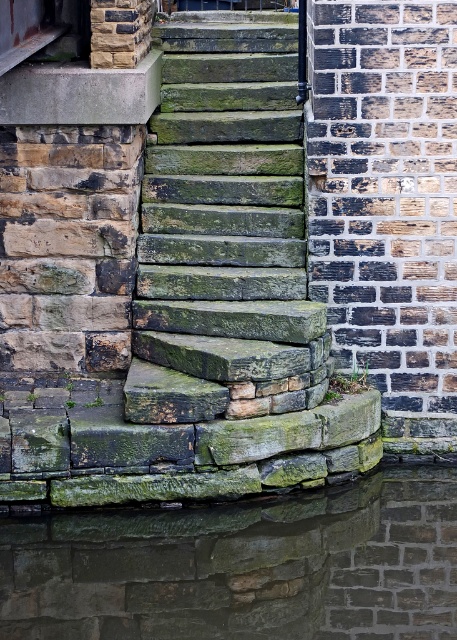
Who is lower down, green mossy stone stairs at center or green mossy stone at lower center?

green mossy stone at lower center is below.

Is green mossy stone stairs at center to the left of green mossy stone at lower center from the viewer's perspective?

Indeed, green mossy stone stairs at center is positioned on the left side of green mossy stone at lower center.

I want to click on green mossy stone stairs at center, so click(224, 234).

At what (x,y) coordinates should I click in order to perform the action: click on green mossy stone stairs at center. Please return your answer as a coordinate pair (x, y). The width and height of the screenshot is (457, 640). Looking at the image, I should click on (224, 234).